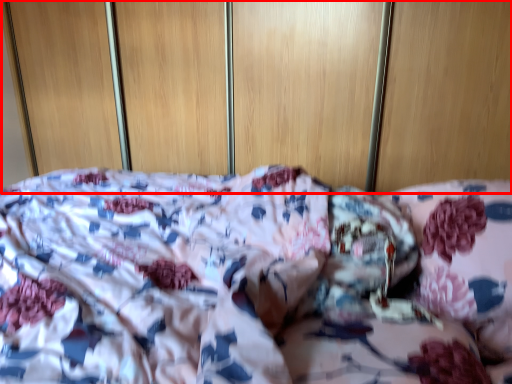
Question: From the image's perspective, where is dresser (annotated by the red box) located relative to pillow?

Choices:
 (A) above
 (B) below

Answer: (A)